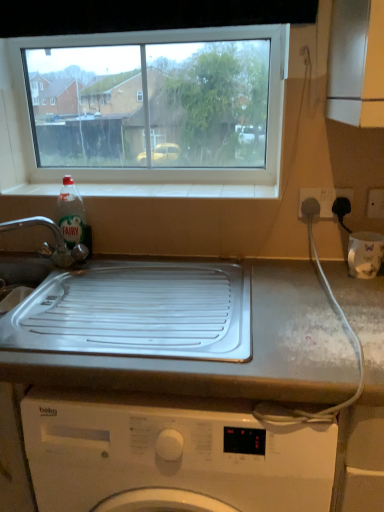
Question: Can you confirm if clear plastic bottle at sink left is wider than white plastic socket at upper right, marked as the second electric outlet in a right-to-left arrangement?

Choices:
 (A) no
 (B) yes

Answer: (B)

Question: Is clear plastic bottle at sink left positioned with its back to white plastic socket at upper right, which is counted as the first electric outlet, starting from the left?

Choices:
 (A) yes
 (B) no

Answer: (B)

Question: Is clear plastic bottle at sink left taller than white plastic socket at upper right, marked as the second electric outlet in a right-to-left arrangement?

Choices:
 (A) no
 (B) yes

Answer: (B)

Question: From the image's perspective, is clear plastic bottle at sink left on top of white plastic socket at upper right, marked as the second electric outlet in a right-to-left arrangement?

Choices:
 (A) yes
 (B) no

Answer: (B)

Question: Considering the relative sizes of clear plastic bottle at sink left and white plastic socket at upper right, marked as the second electric outlet in a right-to-left arrangement, in the image provided, is clear plastic bottle at sink left shorter than white plastic socket at upper right, marked as the second electric outlet in a right-to-left arrangement,?

Choices:
 (A) yes
 (B) no

Answer: (B)

Question: Looking at their shapes, would you say clear plastic bottle at sink left is wider or thinner than white tile at upper center?

Choices:
 (A) wide
 (B) thin

Answer: (B)

Question: Considering the positions of clear plastic bottle at sink left and white tile at upper center in the image, is clear plastic bottle at sink left taller or shorter than white tile at upper center?

Choices:
 (A) tall
 (B) short

Answer: (A)

Question: From the image's perspective, is clear plastic bottle at sink left located above or below white tile at upper center?

Choices:
 (A) above
 (B) below

Answer: (B)

Question: Considering the positions of clear plastic bottle at sink left and white tile at upper center in the image, is clear plastic bottle at sink left bigger or smaller than white tile at upper center?

Choices:
 (A) big
 (B) small

Answer: (B)

Question: Does point (87, 366) appear closer or farther from the camera than point (79, 224)?

Choices:
 (A) closer
 (B) farther

Answer: (A)

Question: Considering the positions of white glossy countertop at center and clear plastic bottle at sink left in the image, is white glossy countertop at center wider or thinner than clear plastic bottle at sink left?

Choices:
 (A) thin
 (B) wide

Answer: (B)

Question: Is white glossy countertop at center in front of or behind clear plastic bottle at sink left in the image?

Choices:
 (A) front
 (B) behind

Answer: (A)

Question: Is white glossy countertop at center inside the boundaries of clear plastic bottle at sink left, or outside?

Choices:
 (A) inside
 (B) outside

Answer: (B)

Question: Considering the positions of white tile at upper center and white glossy countertop at center in the image, is white tile at upper center wider or thinner than white glossy countertop at center?

Choices:
 (A) thin
 (B) wide

Answer: (A)

Question: Is white tile at upper center bigger or smaller than white glossy countertop at center?

Choices:
 (A) small
 (B) big

Answer: (A)